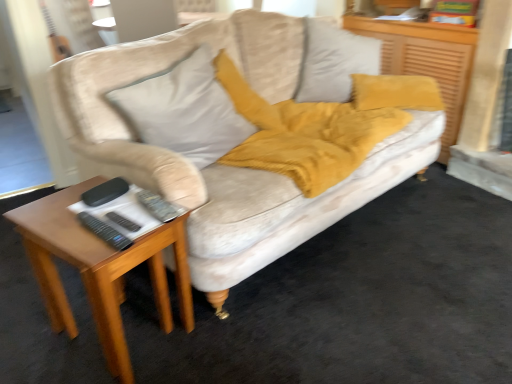
Question: From a real-world perspective, relative to woodenmaterial/texturetable at left, is velvet gray pillow at upper center vertically above or below?

Choices:
 (A) below
 (B) above

Answer: (B)

Question: In the image, is velvet gray pillow at upper center on the left side or the right side of woodenmaterial/texturetable at left?

Choices:
 (A) left
 (B) right

Answer: (B)

Question: Which object is positioned farthest from the velvet beige couch at center?

Choices:
 (A) velvet mustard pillow at upper right
 (B) black plastic remote at lower left, the 2th remote from the front
 (C) velvet gray pillow at upper center
 (D) light gray fabric pillow at upper center
 (E) woodenmaterial/texturetable at left

Answer: (B)

Question: Considering the real-world distances, which object is closest to the black plastic remote at lower left, which is the 2th remote in back-to-front order?

Choices:
 (A) velvet mustard pillow at upper right
 (B) velvet beige couch at center
 (C) velvet gray pillow at upper center
 (D) woodenmaterial/texturetable at left
 (E) light gray fabric pillow at upper center

Answer: (D)